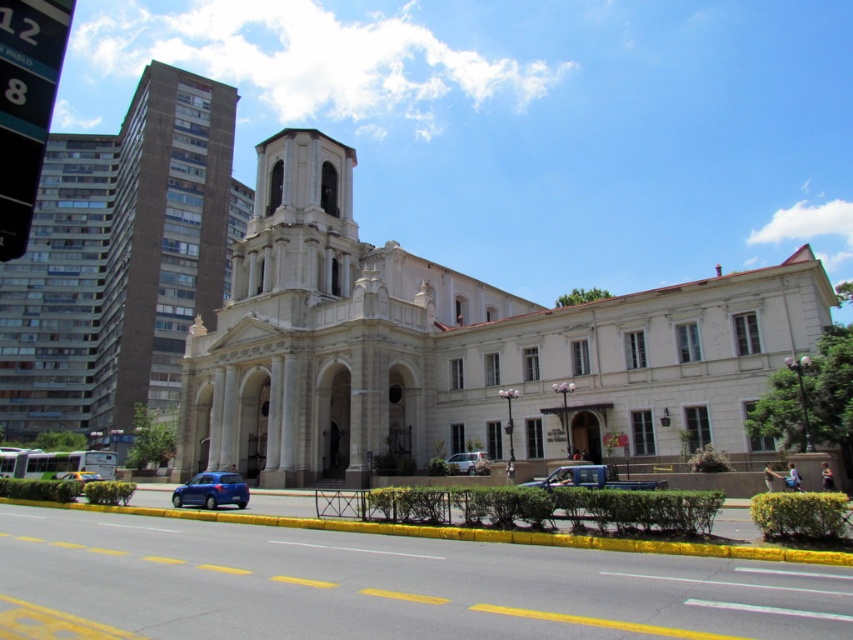
You are a delivery driver who needs to park your vehicle in a parking spot that has a height restriction of 2 meters. You have two vehicles available, a blue metallic truck at center and a metallic blue car at center. Based on the scene, which vehicle is more likely to exceed the height limit?

The blue metallic truck at center is much taller than the metallic blue car at center, so it is more likely to exceed the 2 meters height restriction.